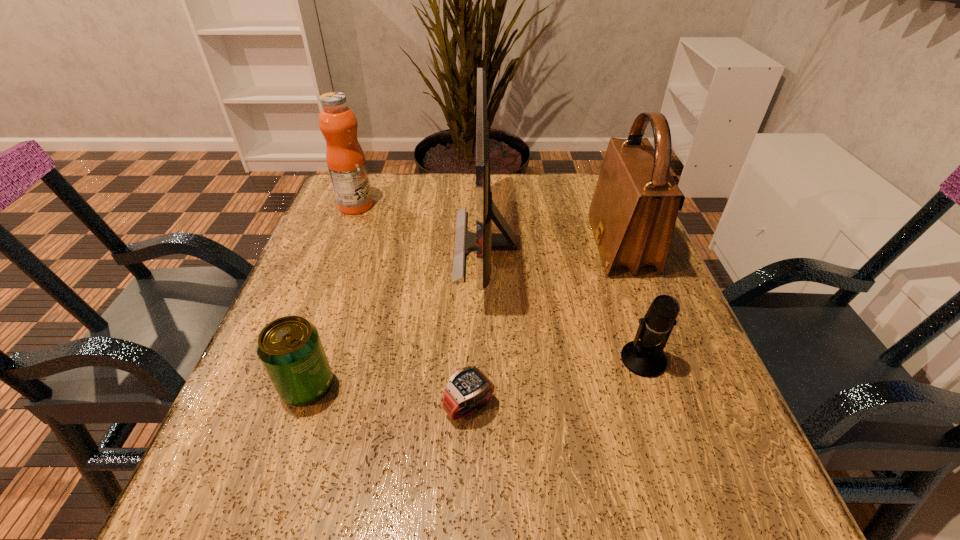
I want to click on beer can located in the left edge section of the desktop, so click(x=290, y=349).

Where is `shoulder bag positioned at the right edge`? Image resolution: width=960 pixels, height=540 pixels. shoulder bag positioned at the right edge is located at coordinates (633, 212).

In order to click on microphone that is at the right edge in this screenshot , I will do `click(642, 357)`.

Where is `object located in the far left corner section of the desktop`? This screenshot has height=540, width=960. object located in the far left corner section of the desktop is located at coordinates (345, 158).

At what (x,y) coordinates should I click in order to perform the action: click on object situated at the far right corner. Please return your answer as a coordinate pair (x, y). Looking at the image, I should click on (633, 212).

Locate an element on the screen. This screenshot has width=960, height=540. vacant region at the far edge of the desktop is located at coordinates (420, 188).

You are a GUI agent. You are given a task and a screenshot of the screen. Output one action in this format:
    pyautogui.click(x=<x>, y=<y>)
    Task: Click on the vacant space at the near edge of the desktop
    
    Given the screenshot: What is the action you would take?
    pyautogui.click(x=572, y=521)

This screenshot has width=960, height=540. What are the coordinates of `vacant space at the left edge of the desktop` in the screenshot? It's located at (362, 237).

Identify the location of free space at the far left corner. (377, 182).

At what (x,y) coordinates should I click in order to perform the action: click on vacant space at the near left corner. Please return your answer as a coordinate pair (x, y). The width and height of the screenshot is (960, 540). Looking at the image, I should click on (266, 514).